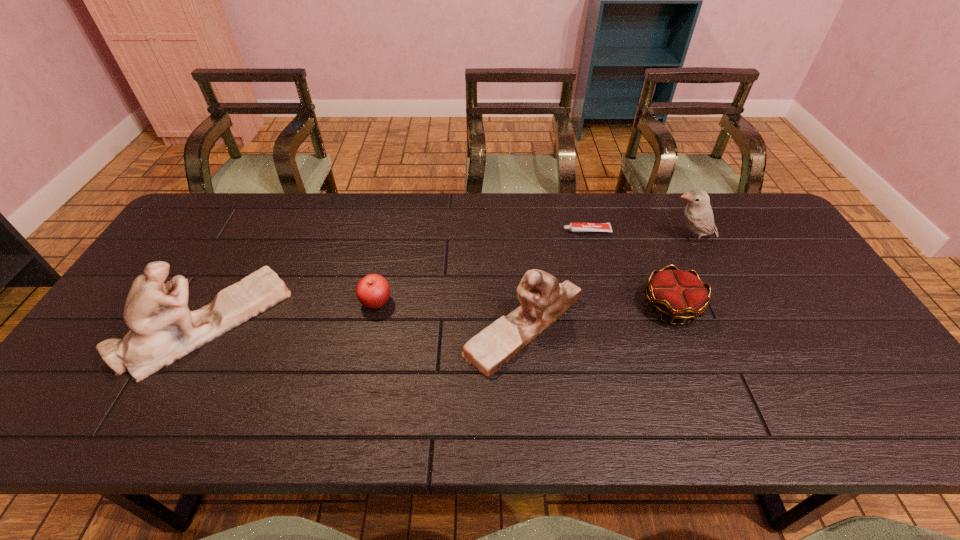
Locate an element on the screen. the second closest object to the crown is located at coordinates (543, 299).

Locate an element on the screen. The width and height of the screenshot is (960, 540). vacant area that satisfies the following two spatial constraints: 1. at the nozzle of the toothpaste; 2. on the left side of the crown is located at coordinates (607, 307).